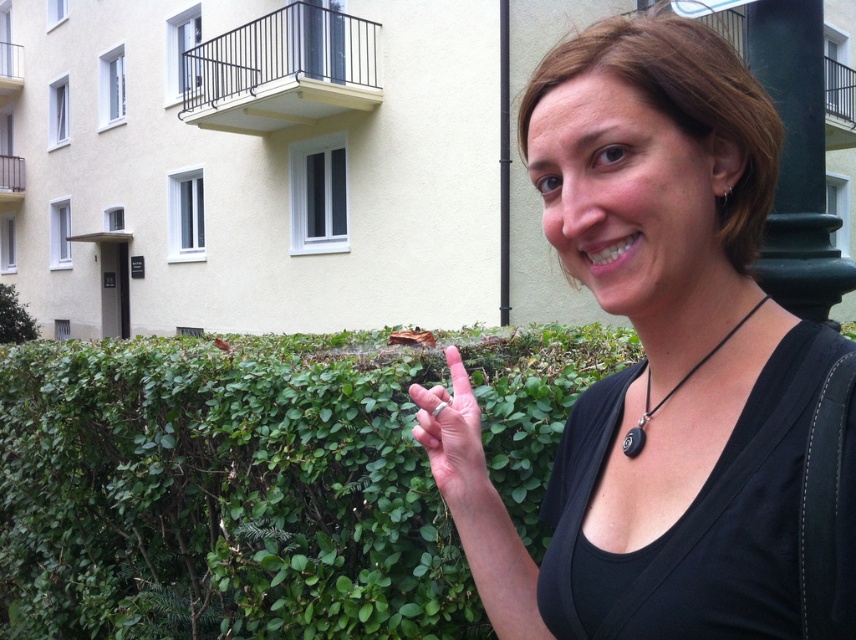
Question: Which point appears farthest from the camera in this image?

Choices:
 (A) (609, 209)
 (B) (643, 413)

Answer: (B)

Question: Can you confirm if green leafy hedge at center is smaller than black matte pendant at lower right?

Choices:
 (A) yes
 (B) no

Answer: (B)

Question: Which point appears farthest from the camera in this image?

Choices:
 (A) (200, 444)
 (B) (479, 524)
 (C) (705, 360)
 (D) (749, 125)

Answer: (A)

Question: Is silver metallic ring at center positioned in front of black matte pendant at lower right?

Choices:
 (A) yes
 (B) no

Answer: (B)

Question: Which point is closer to the camera taking this photo?

Choices:
 (A) 425,625
 (B) 477,444
 (C) 590,493
 (D) 693,365

Answer: (D)

Question: Can you confirm if black matte necklace at upper right is thinner than green leafy hedge at center?

Choices:
 (A) no
 (B) yes

Answer: (B)